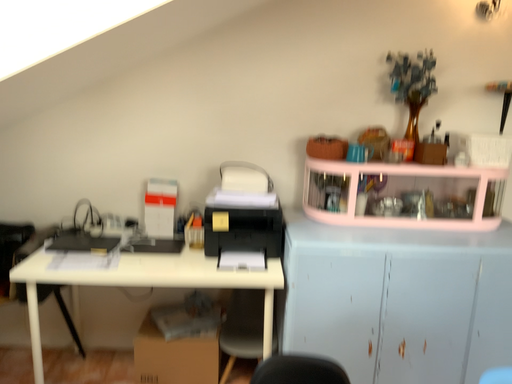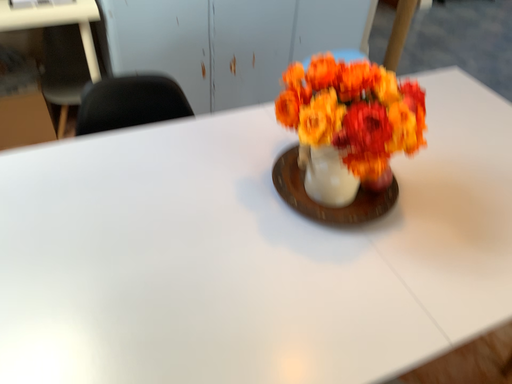
Question: How did the camera likely rotate when shooting the video?

Choices:
 (A) rotated right
 (B) rotated left

Answer: (A)